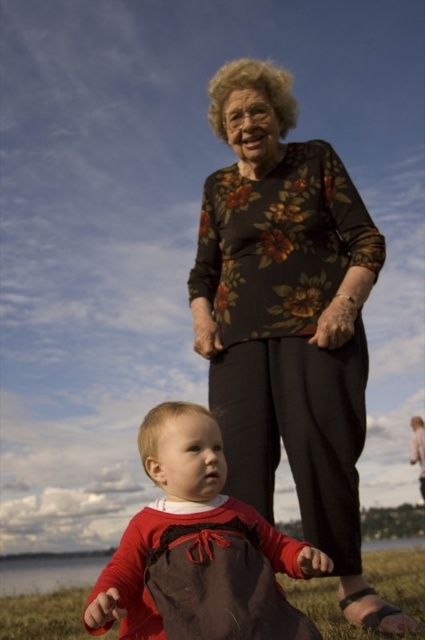
Question: Among these objects, which one is farthest from the camera?

Choices:
 (A) brown textured fabric at lower center
 (B) matte red dress at center

Answer: (A)

Question: Does matte red dress at center have a lesser width compared to brown textured fabric at lower center?

Choices:
 (A) yes
 (B) no

Answer: (A)

Question: Based on their relative distances, which object is nearer to the brown textured fabric at lower center?

Choices:
 (A) floral-patterned blouse at center
 (B) matte red dress at center

Answer: (A)

Question: Which object appears closest to the camera in this image?

Choices:
 (A) floral-patterned blouse at center
 (B) matte red dress at center
 (C) brown textured fabric at lower center

Answer: (B)

Question: Is matte red dress at center wider than brown textured fabric at lower center?

Choices:
 (A) yes
 (B) no

Answer: (B)

Question: Does matte red dress at center appear under brown textured fabric at lower center?

Choices:
 (A) yes
 (B) no

Answer: (B)